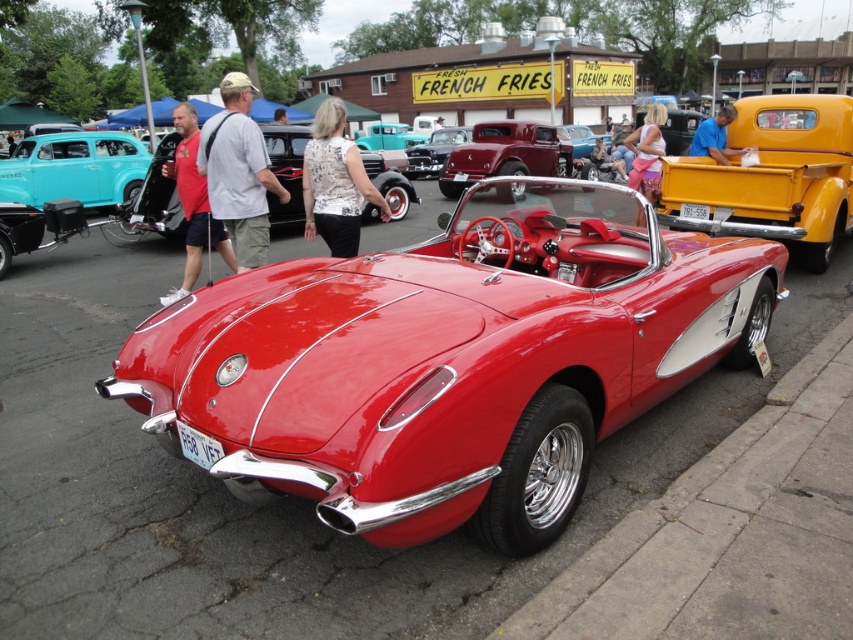
You are a photographer setting up a shoot for a fashion magazine. You need to position a model wearing the white cotton shirt at center so it looks proportional to the teal matte sedan at left. Based on the scene description, should the model stand closer to or farther from the camera than the sedan to maintain the correct proportions?

The white cotton shirt at center is narrower than the teal matte sedan at left. To maintain proportional size, the model should stand closer to the camera than the teal matte sedan at left since objects closer to the camera appear larger.

You are a fashion designer observing a runway show. You notice two garments on the model at the center of the scene. The first is matte red shorts at center, and the second is pink fabric pants at center. Which garment takes up more space on the model?

The pink fabric pants at center occupies more space than matte red shorts at center.

You are a person standing at the edge of the car show, and you want to pick up both the matte red shorts at center and the pink fabric pants at center. Which item is closer to you?

The matte red shorts at center and pink fabric pants at center are 6.03 meters apart from each other, so you need to determine which one is closer based on their positions. However, the description only provides the distance between them, not their individual distances from your position. Without additional information about their exact locations relative to you, it is impossible to determine which is closer.